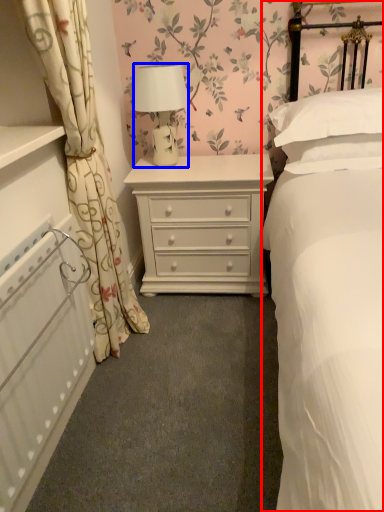
Question: Which of the following is the closest to the observer, bed (highlighted by a red box) or lamp (highlighted by a blue box)?

Choices:
 (A) bed
 (B) lamp

Answer: (A)